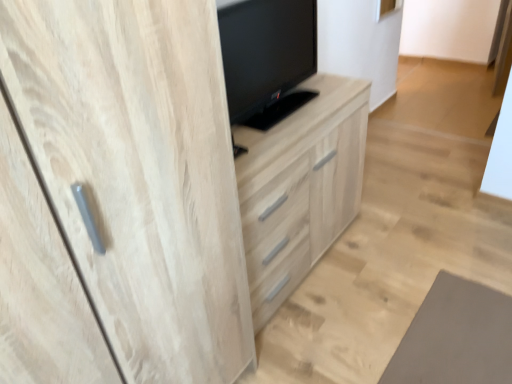
Locate an element on the screen. The height and width of the screenshot is (384, 512). vacant area located to the right-hand side of light wood cabinet at center is located at coordinates (412, 248).